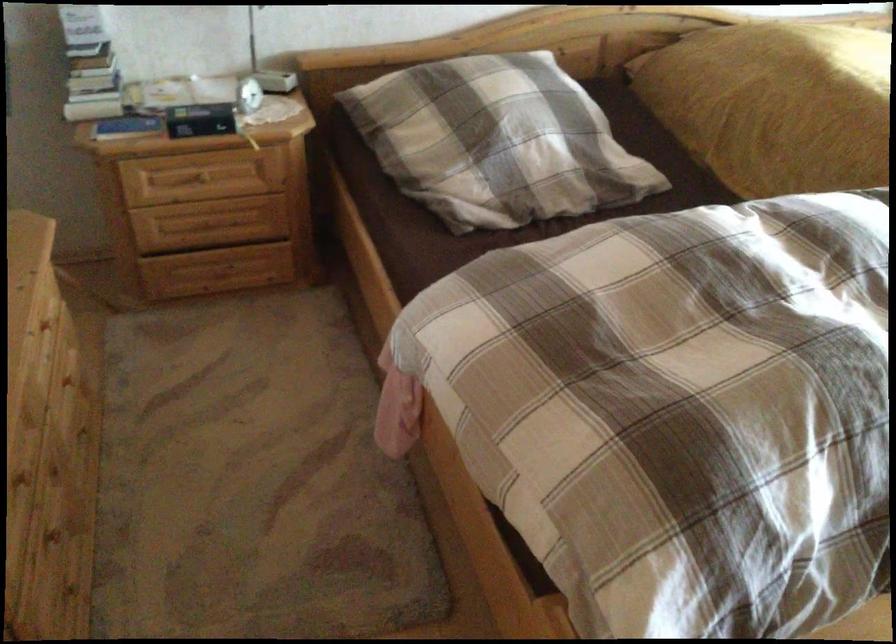
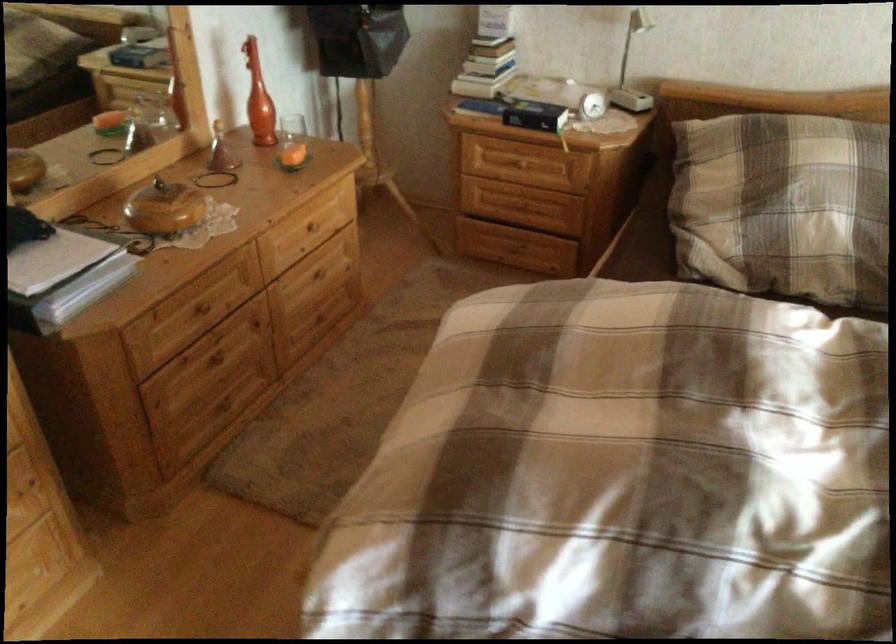
Find the pixel in the second image that matches the point at 212,127 in the first image.

(535, 115)